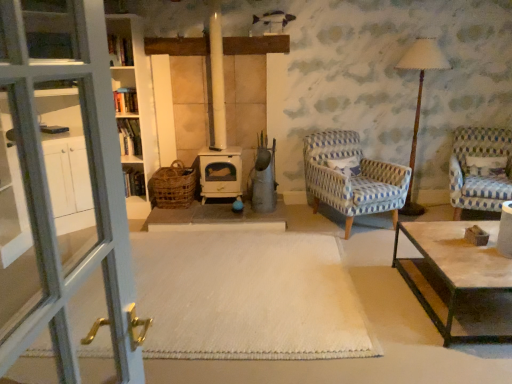
What do you see at coordinates (487, 166) in the screenshot? I see `white textured pillow at right` at bounding box center [487, 166].

In order to face white textured pillow at right, should I rotate leftwards or rightwards?

Rotate your view right by about 28.638°.

The height and width of the screenshot is (384, 512). Describe the element at coordinates (352, 178) in the screenshot. I see `blue and white woven armchair at center-right, which ranks as the 1th chair in left-to-right order` at that location.

The height and width of the screenshot is (384, 512). Describe the element at coordinates (247, 297) in the screenshot. I see `white carpet at center` at that location.

The width and height of the screenshot is (512, 384). What are the coordinates of `white textured pillow at right` in the screenshot? It's located at (487, 166).

What are the coordinates of `the 1st chair to the right when counting from the white carpet at center` in the screenshot? It's located at (352, 178).

Which point is more distant from viewer, (308,172) or (232,283)?

The point (308,172) is more distant.

Is blue and white woven armchair at center-right, which ranks as the 1th chair in left-to-right order, not inside white carpet at center?

That's correct, blue and white woven armchair at center-right, which ranks as the 1th chair in left-to-right order, is outside of white carpet at center.

Are blue and white woven armchair at center-right, positioned as the second chair in right-to-left order, and white carpet at center beside each other?

blue and white woven armchair at center-right, positioned as the second chair in right-to-left order, and white carpet at center are clearly separated.

Between blue and white checkered fabric armchair at right, which is the 2th chair from left to right, and white carpet at center, which one appears on the right side from the viewer's perspective?

Positioned to the right is blue and white checkered fabric armchair at right, which is the 2th chair from left to right.

Is blue and white checkered fabric armchair at right, the 1th chair from the right, beside white carpet at center?

No, blue and white checkered fabric armchair at right, the 1th chair from the right, is not beside white carpet at center.

From the image's perspective, which one is positioned higher, blue and white checkered fabric armchair at right, which is the 2th chair from left to right, or white carpet at center?

blue and white checkered fabric armchair at right, which is the 2th chair from left to right, appears higher in the image.

Which is behind, point (479, 190) or point (168, 348)?

Positioned behind is point (479, 190).

From a real-world perspective, is white carpet at center beneath blue and white woven armchair at center-right, which ranks as the 1th chair in left-to-right order?

Indeed, from a real-world perspective, white carpet at center is positioned beneath blue and white woven armchair at center-right, which ranks as the 1th chair in left-to-right order.

From their relative heights in the image, would you say white carpet at center is taller or shorter than blue and white woven armchair at center-right, positioned as the second chair in right-to-left order?

Clearly, white carpet at center is shorter compared to blue and white woven armchair at center-right, positioned as the second chair in right-to-left order.

Identify the location of chair that is the 1st object located above the white carpet at center (from the image's perspective). (352, 178).

From a real-world perspective, which object stands above the other?

white textured pillow at right.

Which is in front, blue and white woven armchair at center-right, positioned as the second chair in right-to-left order, or white textured pillow at right?

blue and white woven armchair at center-right, positioned as the second chair in right-to-left order.

From a real-world perspective, count 2nd chairs downward from the white textured pillow at right and point to it. Please provide its 2D coordinates.

[(352, 178)]

Which point is more forward, (353, 208) or (484, 158)?

Positioned in front is point (353, 208).

How far apart are wooden bookshelf at center and blue and white checkered fabric armchair at right, the 1th chair from the right?

wooden bookshelf at center and blue and white checkered fabric armchair at right, the 1th chair from the right, are 3.31 meters apart.

From the image's perspective, between wooden bookshelf at center and blue and white checkered fabric armchair at right, which is the 2th chair from left to right, which one is located above?

blue and white checkered fabric armchair at right, which is the 2th chair from left to right, is shown above in the image.

From the picture: Are wooden bookshelf at center and blue and white checkered fabric armchair at right, which is the 2th chair from left to right, far apart?

Absolutely, wooden bookshelf at center is distant from blue and white checkered fabric armchair at right, which is the 2th chair from left to right.

Can you tell me how much wooden bookshelf at center and blue and white checkered fabric armchair at right, the 1th chair from the right, differ in facing direction?

The angle between the facing direction of wooden bookshelf at center and the facing direction of blue and white checkered fabric armchair at right, the 1th chair from the right, is 22 degrees.

Which is less distant, (127, 187) or (228, 277)?

The point (228, 277) is closer to the camera.

In the scene shown: Considering the sizes of objects wooden bookshelf at center and white carpet at center in the image provided, who is smaller, wooden bookshelf at center or white carpet at center?

With smaller size is wooden bookshelf at center.

Is wooden bookshelf at center shorter than white carpet at center?

In fact, wooden bookshelf at center may be taller than white carpet at center.

Would you say wooden bookshelf at center is a long distance from white carpet at center?

Yes, wooden bookshelf at center and white carpet at center are located far from each other.

Considering the relative positions of wooden bookshelf at center and white textured pillow at right in the image provided, is wooden bookshelf at center to the right of white textured pillow at right from the viewer's perspective?

In fact, wooden bookshelf at center is to the left of white textured pillow at right.

Consider the image. Is wooden bookshelf at center inside the boundaries of white textured pillow at right, or outside?

wooden bookshelf at center is not enclosed by white textured pillow at right.

Considering the sizes of objects wooden bookshelf at center and white textured pillow at right in the image provided, who is wider, wooden bookshelf at center or white textured pillow at right?

With larger width is wooden bookshelf at center.

Is wooden bookshelf at center positioned far away from white textured pillow at right?

Yes, wooden bookshelf at center and white textured pillow at right are quite far apart.

Find the location of a particular element. the 1st chair to the right of the white carpet at center, counting from the anchor's position is located at coordinates (352, 178).

Identify the location of plain lying in front of the blue and white checkered fabric armchair at right, which is the 2th chair from left to right. (247, 297).

Looking at the image, which one is located closer to wooden bookshelf at center, blue and white woven armchair at center-right, which ranks as the 1th chair in left-to-right order, or white carpet at center?

The object closer to wooden bookshelf at center is white carpet at center.

Considering their positions, is rustic wicker basket at center positioned further to white textured pillow at right than white carpet at center?

rustic wicker basket at center is positioned further to the anchor white textured pillow at right.

Which object lies further to the anchor point blue and white checkered fabric armchair at right, the 1th chair from the right, rustic wicker basket at center or white textured pillow at right?

rustic wicker basket at center is positioned further to the anchor blue and white checkered fabric armchair at right, the 1th chair from the right.

Looking at the image, which one is located closer to blue and white woven armchair at center-right, positioned as the second chair in right-to-left order, white textured pillow at right or wooden bookshelf at center?

white textured pillow at right is closer to blue and white woven armchair at center-right, positioned as the second chair in right-to-left order.

Which object lies nearer to the anchor point white textured pillow at right, wooden table lamp at right or white carpet at center?

Among the two, wooden table lamp at right is located nearer to white textured pillow at right.

Which object lies nearer to the anchor point rustic wicker basket at center, blue and white checkered fabric armchair at right, which is the 2th chair from left to right, or white carpet at center?

white carpet at center lies closer to rustic wicker basket at center than the other object.

Consider the image. From the image, which object appears to be farther from wooden bookshelf at center, blue and white woven armchair at center-right, which ranks as the 1th chair in left-to-right order, or wooden table lamp at right?

wooden table lamp at right.

Looking at the image, which one is located closer to wooden bookshelf at center, wooden table lamp at right or blue and white woven armchair at center-right, positioned as the second chair in right-to-left order?

Based on the image, blue and white woven armchair at center-right, positioned as the second chair in right-to-left order, appears to be nearer to wooden bookshelf at center.

Image resolution: width=512 pixels, height=384 pixels. I want to click on table lamp located between rustic wicker basket at center and white textured pillow at right in the left-right direction, so (x=419, y=99).

Identify the location of plain between rustic wicker basket at center and blue and white checkered fabric armchair at right, the 1th chair from the right. (247, 297).

The image size is (512, 384). I want to click on basket between white carpet at center and wooden bookshelf at center in the front-back direction, so coord(173,186).

This screenshot has height=384, width=512. Find the location of `chair between white carpet at center and wooden table lamp at right in the horizontal direction`. chair between white carpet at center and wooden table lamp at right in the horizontal direction is located at coordinates (352, 178).